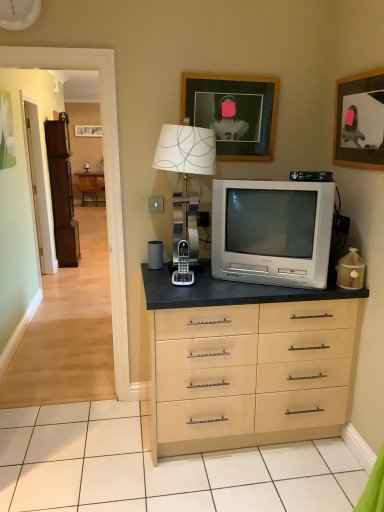
Question: Is white matte clock at upper left completely or partially outside of brown wooden armoire at left?

Choices:
 (A) no
 (B) yes

Answer: (B)

Question: Is white matte clock at upper left in front of brown wooden armoire at left?

Choices:
 (A) yes
 (B) no

Answer: (A)

Question: Can you confirm if white matte clock at upper left is bigger than brown wooden armoire at left?

Choices:
 (A) no
 (B) yes

Answer: (A)

Question: Is white matte clock at upper left to the left of brown wooden armoire at left from the viewer's perspective?

Choices:
 (A) yes
 (B) no

Answer: (B)

Question: From a real-world perspective, is white matte clock at upper left physically below brown wooden armoire at left?

Choices:
 (A) no
 (B) yes

Answer: (A)

Question: Is white matte clock at upper left taller than brown wooden armoire at left?

Choices:
 (A) yes
 (B) no

Answer: (B)

Question: From a real-world perspective, is wooden floor at left positioned over black plastic phone at center based on gravity?

Choices:
 (A) no
 (B) yes

Answer: (B)

Question: Are wooden floor at left and black plastic phone at center making contact?

Choices:
 (A) no
 (B) yes

Answer: (A)

Question: Could you tell me if wooden floor at left is turned towards black plastic phone at center?

Choices:
 (A) yes
 (B) no

Answer: (B)

Question: Considering the relative sizes of wooden floor at left and black plastic phone at center in the image provided, is wooden floor at left smaller than black plastic phone at center?

Choices:
 (A) yes
 (B) no

Answer: (B)

Question: Is wooden floor at left at the right side of black plastic phone at center?

Choices:
 (A) yes
 (B) no

Answer: (B)

Question: Is wooden floor at left surrounding black plastic phone at center?

Choices:
 (A) no
 (B) yes

Answer: (A)

Question: Is silver metallic television at center behind white matte clock at upper left?

Choices:
 (A) no
 (B) yes

Answer: (A)